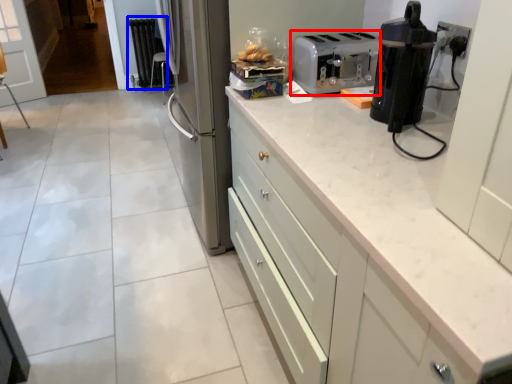
Question: Which of the following is the farthest to the observer, kitchen appliance (highlighted by a red box) or radiator (highlighted by a blue box)?

Choices:
 (A) kitchen appliance
 (B) radiator

Answer: (B)